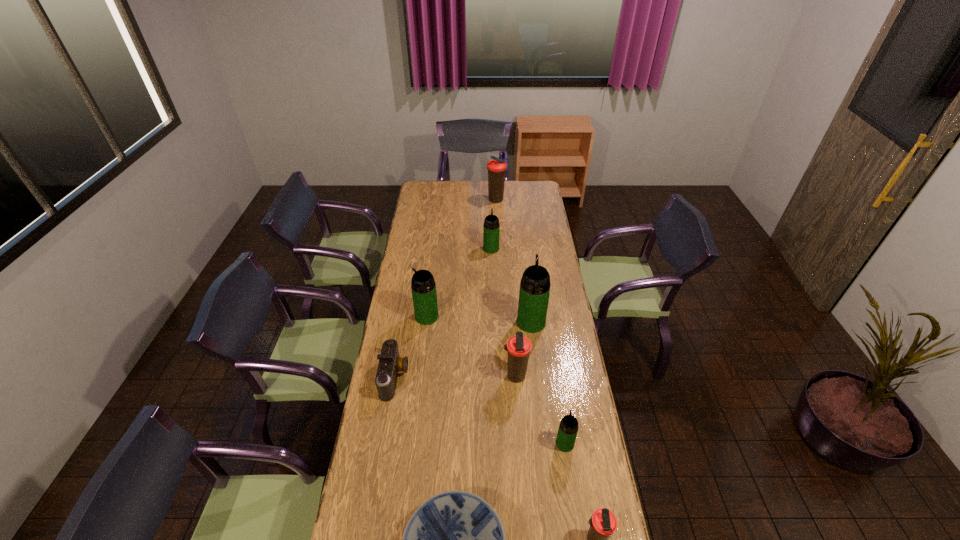
Point out which green thermos bottle is positioned as the third nearest to the smallest brown thermos bottle. Please provide its 2D coordinates. Your answer should be formatted as a tuple, i.e. [(x, y)], where the tuple contains the x and y coordinates of a point satisfying the conditions above.

[(423, 286)]

Select which brown thermos bottle appears as the closest to the nearest thermos bottle. Please provide its 2D coordinates. Your answer should be formatted as a tuple, i.e. [(x, y)], where the tuple contains the x and y coordinates of a point satisfying the conditions above.

[(518, 347)]

Locate an element on the screen. Image resolution: width=960 pixels, height=540 pixels. brown thermos bottle that stands as the second closest to the blue plate is located at coordinates (518, 347).

The height and width of the screenshot is (540, 960). I want to click on vacant region that satisfies the following two spatial constraints: 1. from the spout of the second nearest brown thermos bottle; 2. on the left side of the leftmost green thermos bottle, so click(x=420, y=376).

Where is `free location that satisfies the following two spatial constraints: 1. from the spout of the second farthest thermos bottle; 2. on the right side of the farthest thermos bottle`? Image resolution: width=960 pixels, height=540 pixels. free location that satisfies the following two spatial constraints: 1. from the spout of the second farthest thermos bottle; 2. on the right side of the farthest thermos bottle is located at coordinates (490, 200).

Locate an element on the screen. vacant position in the image that satisfies the following two spatial constraints: 1. on the lens of the eighth tallest object; 2. from the spout of the smallest green thermos bottle is located at coordinates (383, 443).